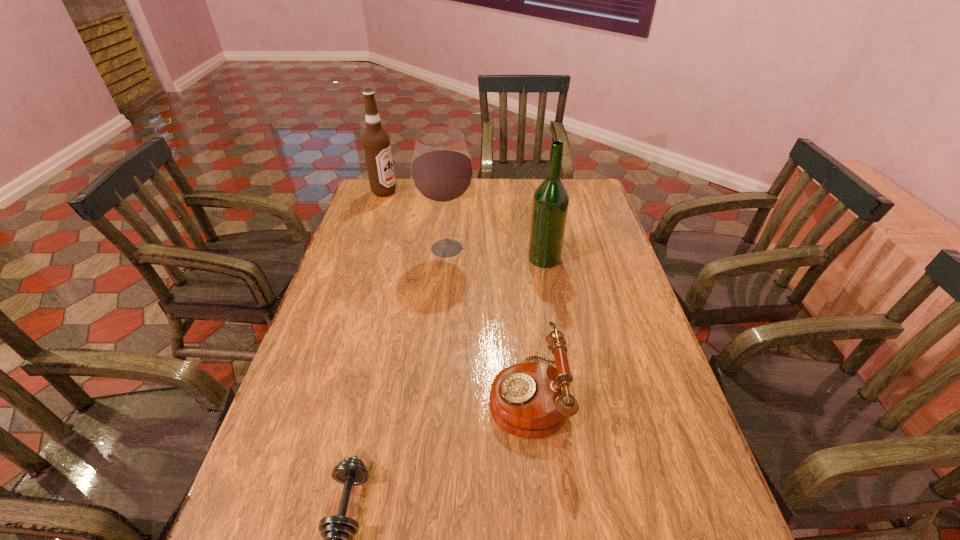
Find the location of `vacant space located 0.320m on the dial of the telephone`. vacant space located 0.320m on the dial of the telephone is located at coordinates (355, 395).

Locate an element on the screen. This screenshot has width=960, height=540. vacant space located 0.400m on the dial of the telephone is located at coordinates (322, 395).

Identify the location of object at the far edge. (376, 142).

Locate an element on the screen. object that is at the left edge is located at coordinates (376, 142).

The image size is (960, 540). In order to click on object that is at the far left corner in this screenshot , I will do `click(376, 142)`.

The width and height of the screenshot is (960, 540). In the image, there is a desktop. What are the coordinates of `free space at the far edge` in the screenshot? It's located at (496, 201).

The width and height of the screenshot is (960, 540). I want to click on free space at the left edge of the desktop, so click(269, 451).

You are a GUI agent. You are given a task and a screenshot of the screen. Output one action in this format:
    pyautogui.click(x=<x>, y=<y>)
    Task: Click on the free region at the right edge
    This screenshot has width=960, height=540.
    Given the screenshot: What is the action you would take?
    pyautogui.click(x=578, y=241)

Find the location of a particular element. This screenshot has height=540, width=960. empty location between the farthest alcohol and the rightmost alcohol is located at coordinates (465, 225).

This screenshot has width=960, height=540. I want to click on vacant space that's between the fourth tallest object and the second alcohol from right to left, so click(x=488, y=322).